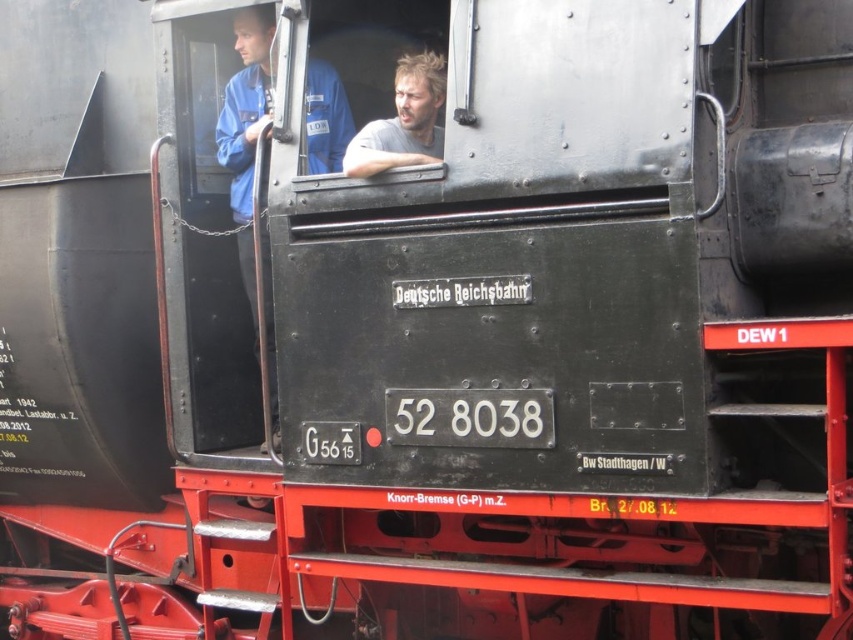
You are a passenger on the Deutsche Reichsbahn locomotive and notice two items in the cab area. One is a blue fabric shirt at left and the other is light brown hair at center. From your perspective inside the cab, which item is closer to you?

The blue fabric shirt at left is closer to you because the light brown hair at center is behind it.

You are a photographer taking a picture of the locomotive and notice two people in the frame. One is wearing a blue fabric shirt at left, and the other has light brown hair at center. From the photographer s perspective, which person is positioned farther to the left?

The blue fabric shirt at left is positioned farther to the left compared to the light brown hair at center, as it is located to the left of the latter.